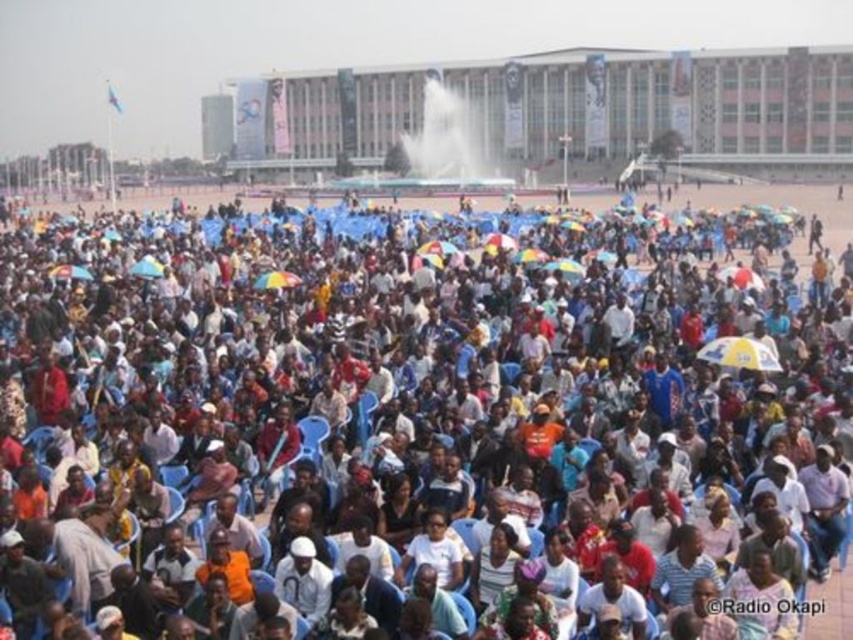
You are standing at the entrance of the large modern building in the background. You need to reach the white plastic chairs at center. Which direction should you walk to get there?

The white plastic chairs at center are located at point (407,404), so you should walk forward and to the right from the entrance of the large modern building in the background to reach them.